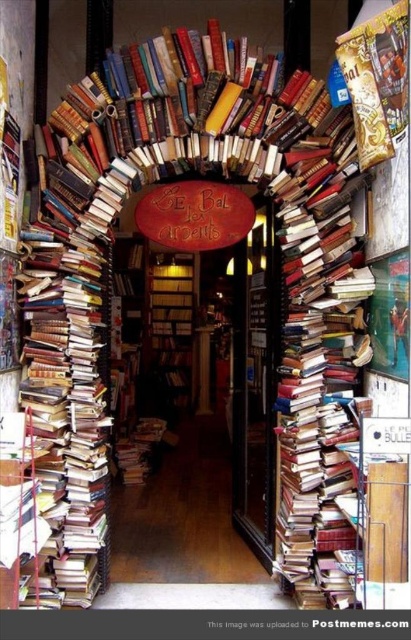
Question: Which point is closer to the camera?

Choices:
 (A) wooden door at center
 (B) wooden bookshelf at center

Answer: (B)

Question: Is the position of wooden door at center less distant than that of wooden bookshelf at center?

Choices:
 (A) yes
 (B) no

Answer: (B)

Question: Does wooden door at center appear under wooden bookshelf at center?

Choices:
 (A) yes
 (B) no

Answer: (B)

Question: Does wooden door at center come behind wooden bookshelf at center?

Choices:
 (A) yes
 (B) no

Answer: (A)

Question: Which point is closer to the camera?

Choices:
 (A) wooden door at center
 (B) wooden bookshelf at center

Answer: (B)

Question: Which point is closer to the camera?

Choices:
 (A) (175, 332)
 (B) (267, 524)

Answer: (B)